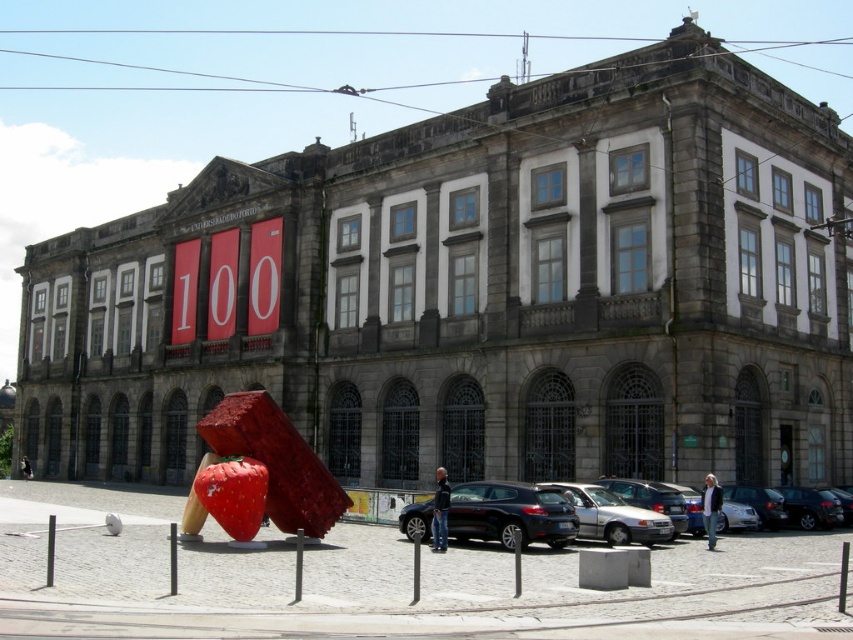
Question: Is silver metallic car at lower center below shiny black car at center?

Choices:
 (A) no
 (B) yes

Answer: (B)

Question: Observing the image, what is the correct spatial positioning of silver metallic car at lower center in reference to shiny black car at center?

Choices:
 (A) below
 (B) above

Answer: (A)

Question: Does silver metallic car at lower center have a smaller size compared to shiny black car at center?

Choices:
 (A) no
 (B) yes

Answer: (A)

Question: Which point is farther from the camera taking this photo?

Choices:
 (A) (482, 502)
 (B) (564, 506)

Answer: (A)

Question: Which point is closer to the camera?

Choices:
 (A) shiny black car at center
 (B) silver metallic car at lower center

Answer: (A)

Question: Which point is closer to the camera?

Choices:
 (A) (561, 483)
 (B) (524, 538)

Answer: (B)